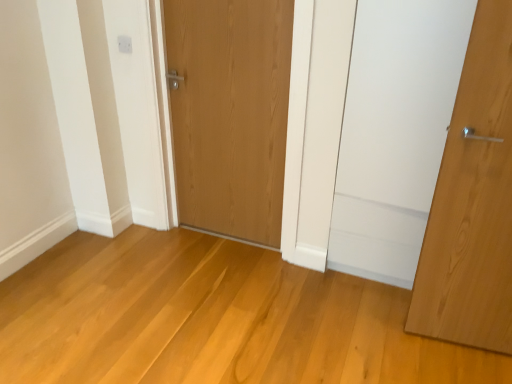
The image size is (512, 384). Find the location of `vacant point to the left of natural wood door at right, the 1th door when ordered from right to left`. vacant point to the left of natural wood door at right, the 1th door when ordered from right to left is located at coordinates (387, 327).